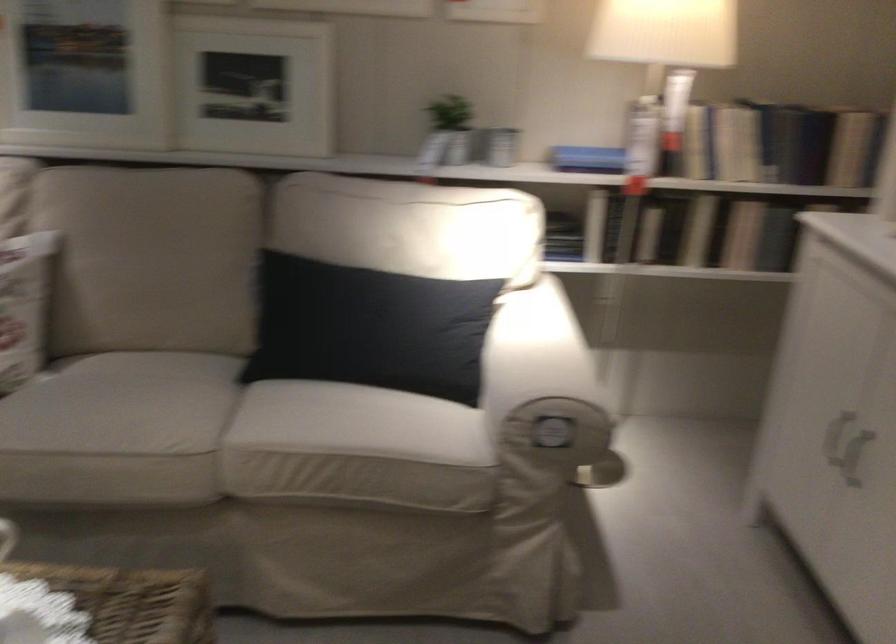
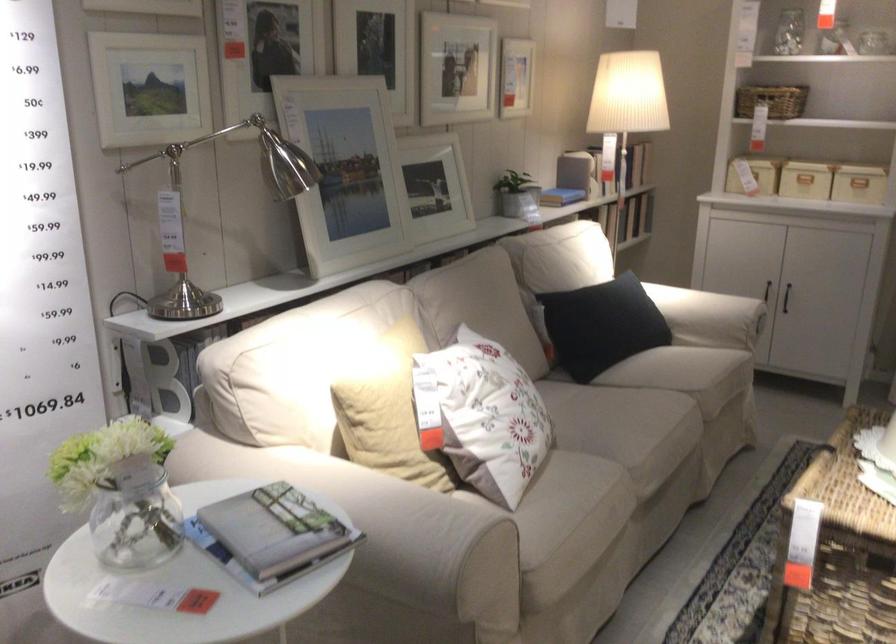
In the second image, find the point that corresponds to (x=309, y=323) in the first image.

(600, 325)